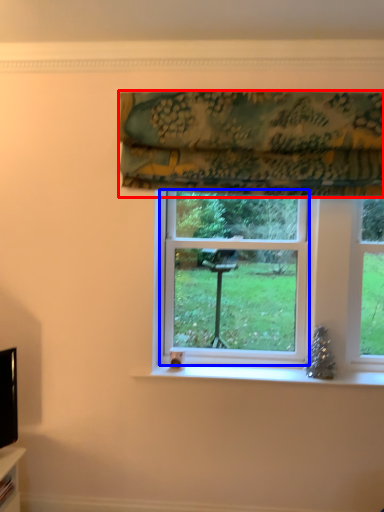
Question: Which object appears closest to the camera in this image, curtain (highlighted by a red box) or bay window (highlighted by a blue box)?

Choices:
 (A) curtain
 (B) bay window

Answer: (A)